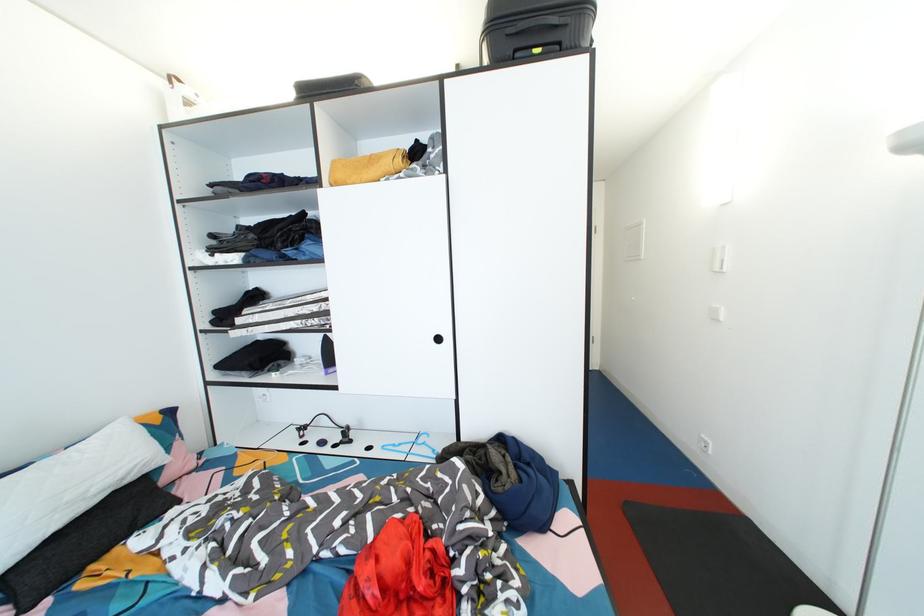
This screenshot has width=924, height=616. Identify the location of lamp gooseneck. (901, 477).